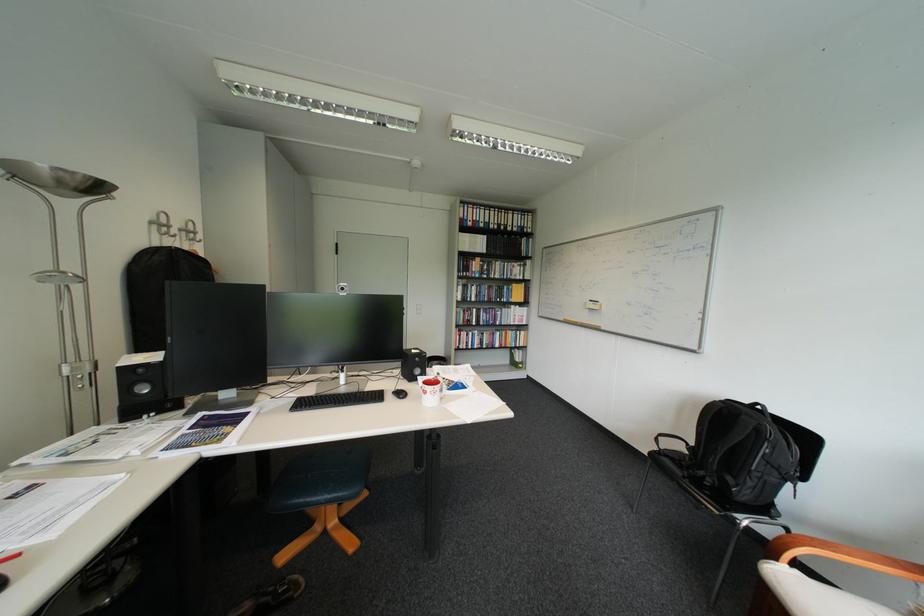
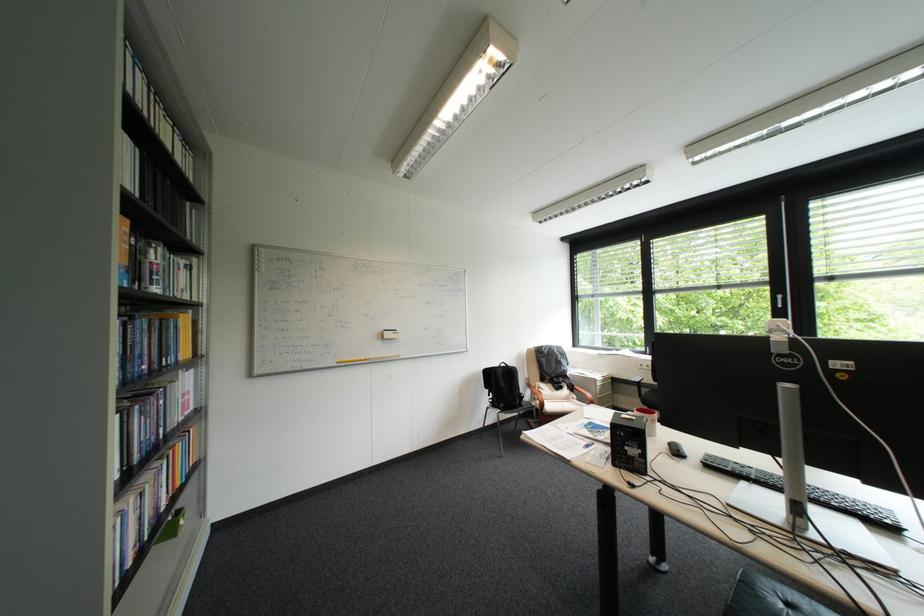
Locate, in the second image, the point that corresponds to (x=602, y=302) in the first image.

(397, 331)